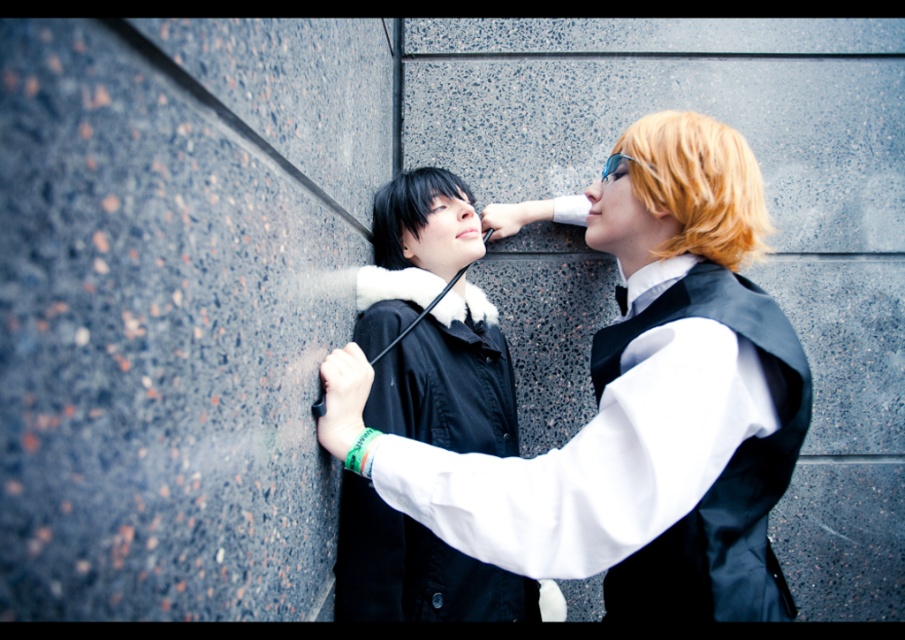
Question: Is the position of black matte jacket at center less distant than that of clear plastic goggles at upper center?

Choices:
 (A) no
 (B) yes

Answer: (B)

Question: Which point appears closest to the camera in this image?

Choices:
 (A) (624, 157)
 (B) (588, 192)
 (C) (433, 179)

Answer: (A)

Question: Can you confirm if matte black jacket at center is thinner than black matte jacket at center?

Choices:
 (A) yes
 (B) no

Answer: (B)

Question: Which of the following is the closest to the observer?

Choices:
 (A) (412, 225)
 (B) (606, 541)
 (C) (603, 182)

Answer: (B)

Question: Does matte black jacket at center appear on the left side of clear plastic goggles at upper center?

Choices:
 (A) no
 (B) yes

Answer: (A)

Question: Which of the following is the farthest from the observer?

Choices:
 (A) (339, 609)
 (B) (624, 157)
 (C) (710, 244)

Answer: (A)